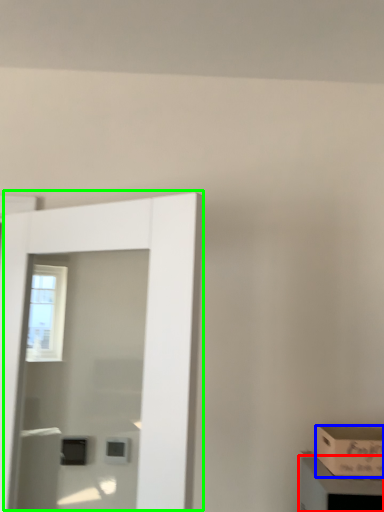
Question: Which object is the closest to the cabinetry (highlighted by a red box)? Choose among these: box (highlighted by a blue box) or door (highlighted by a green box).

Choices:
 (A) box
 (B) door

Answer: (A)